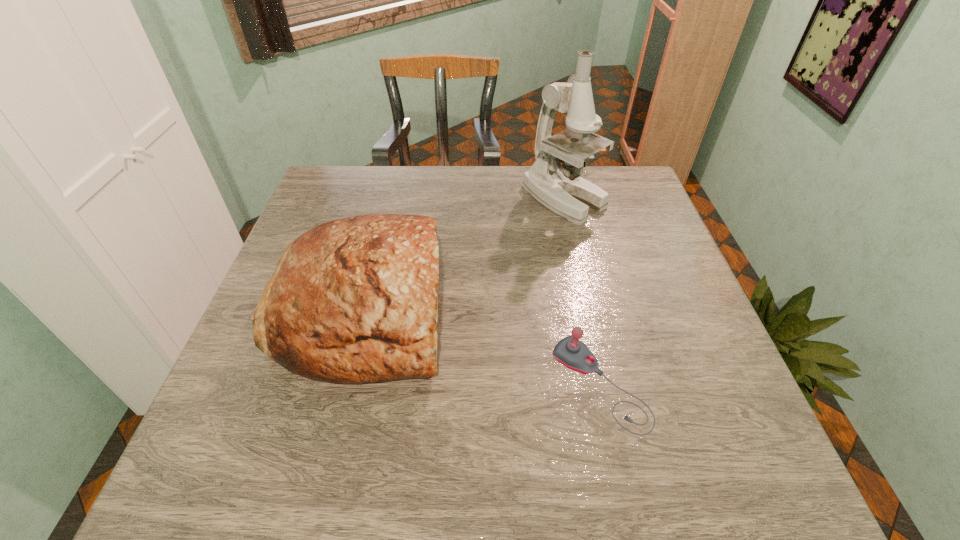
Find the location of a particular element. Image resolution: width=960 pixels, height=540 pixels. empty space that is in between the microscope and the shortest object is located at coordinates (582, 292).

Find the location of `free space between the joystick and the farthest object`. free space between the joystick and the farthest object is located at coordinates (582, 292).

Where is `vacant area that lies between the joystick and the leftmost object`? Image resolution: width=960 pixels, height=540 pixels. vacant area that lies between the joystick and the leftmost object is located at coordinates (481, 346).

Locate an element on the screen. The height and width of the screenshot is (540, 960). unoccupied position between the microscope and the leftmost object is located at coordinates (463, 253).

I want to click on free space that is in between the bread and the joystick, so (481, 346).

Where is `free space between the joystick and the leftmost object`? free space between the joystick and the leftmost object is located at coordinates (481, 346).

Find the location of a particular element. This screenshot has width=960, height=540. free space between the second shortest object and the shortest object is located at coordinates (481, 346).

Identify the location of free spot between the farthest object and the joystick. [582, 292].

You are a GUI agent. You are given a task and a screenshot of the screen. Output one action in this format:
    pyautogui.click(x=<x>, y=<y>)
    Task: Click on the unoccupied position between the second shortest object and the shortest object
    This screenshot has height=540, width=960.
    Given the screenshot: What is the action you would take?
    (481, 346)

Find the location of a particular element. This screenshot has height=540, width=960. vacant area between the leftmost object and the shortest object is located at coordinates (481, 346).